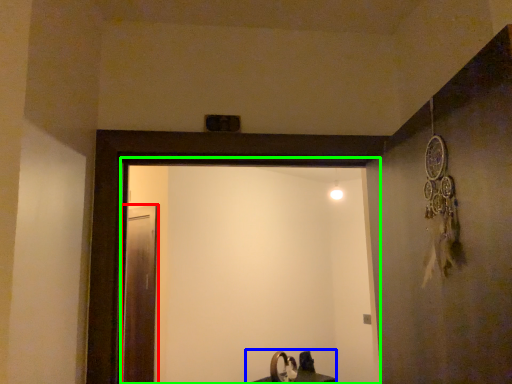
Question: Based on their relative distances, which object is nearer to screen door (highlighted by a red box)? Choose from sink (highlighted by a blue box) and screen door (highlighted by a green box).

Choices:
 (A) sink
 (B) screen door

Answer: (B)